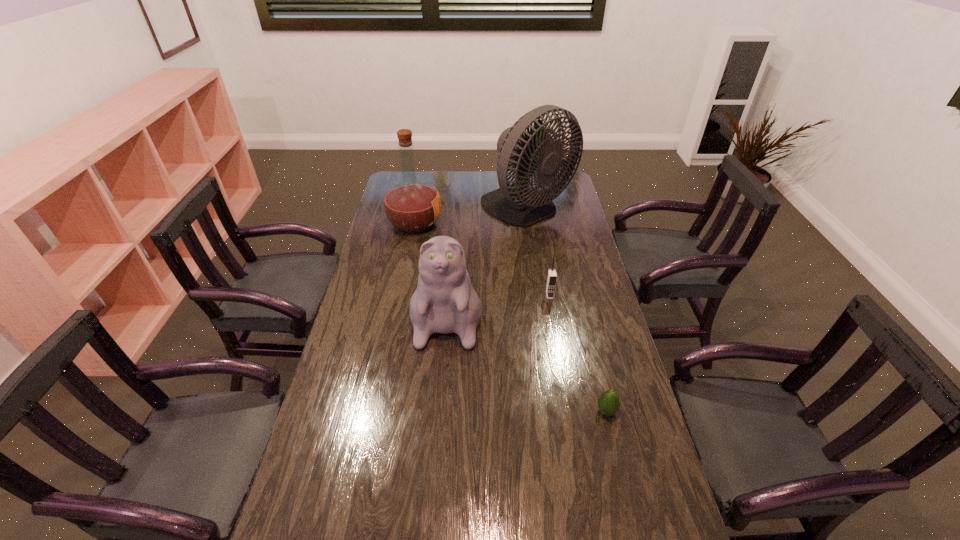
Where is `vacant space positioned on the back of the nearest object`? vacant space positioned on the back of the nearest object is located at coordinates (592, 354).

The width and height of the screenshot is (960, 540). Find the location of `object located in the far edge section of the desktop`. object located in the far edge section of the desktop is located at coordinates (518, 204).

Locate an element on the screen. object that is at the left edge is located at coordinates (412, 205).

Identify the location of fan at the right edge. (518, 204).

Where is `avocado at the right edge`? Image resolution: width=960 pixels, height=540 pixels. avocado at the right edge is located at coordinates (608, 402).

Locate an element on the screen. Image resolution: width=960 pixels, height=540 pixels. object that is at the far right corner is located at coordinates (518, 204).

You are a GUI agent. You are given a task and a screenshot of the screen. Output one action in this format:
    pyautogui.click(x=<x>, y=<y>)
    Task: Click on the free space at the far edge
    The height and width of the screenshot is (540, 960).
    Given the screenshot: What is the action you would take?
    pyautogui.click(x=437, y=181)

This screenshot has height=540, width=960. Find the location of `vacant point at the left edge`. vacant point at the left edge is located at coordinates (347, 395).

The width and height of the screenshot is (960, 540). What are the coordinates of `vacant space at the right edge` in the screenshot? It's located at (550, 254).

Find the location of a particular element. vacant space at the far left corner is located at coordinates (396, 171).